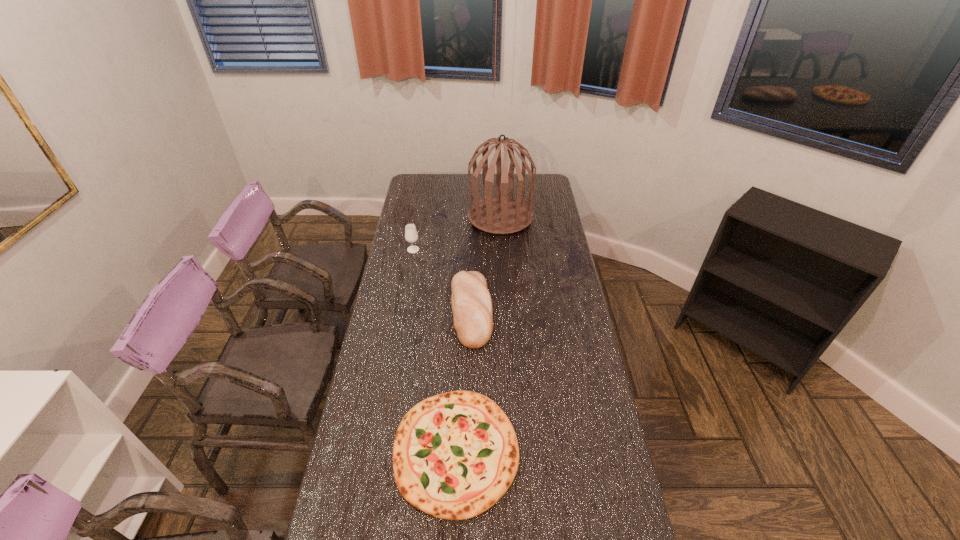
You are a GUI agent. You are given a task and a screenshot of the screen. Output one action in this format:
    pyautogui.click(x=<x>, y=<y>)
    Task: Click on the vacant space in between the leftmost object and the farthest object
    
    Given the screenshot: What is the action you would take?
    (x=457, y=233)

Identify the location of unoccupied area between the bread and the tallest object. (486, 264).

Locate an element on the screen. vacant space in between the second tallest object and the shortest object is located at coordinates (435, 350).

Find the location of `vacant area that lies between the shortest object and the second nearest object`. vacant area that lies between the shortest object and the second nearest object is located at coordinates (464, 381).

At what (x,y) coordinates should I click in order to perform the action: click on blank region between the glass and the bread. Please return your answer as a coordinate pair (x, y). The width and height of the screenshot is (960, 540). Looking at the image, I should click on (443, 280).

Identify the location of unoccupied position between the pizza and the leftmost object. The image size is (960, 540). (435, 350).

This screenshot has width=960, height=540. Identify the location of unoccupied area between the tallest object and the leftmost object. (457, 233).

Find the location of a particular element. This screenshot has height=540, width=960. free point between the bread and the glass is located at coordinates (443, 280).

The image size is (960, 540). In order to click on object that stands as the second closest to the shortest object in this screenshot , I will do coord(411,235).

Locate an element on the screen. The width and height of the screenshot is (960, 540). object that ranks as the third closest to the nearest object is located at coordinates (502, 215).